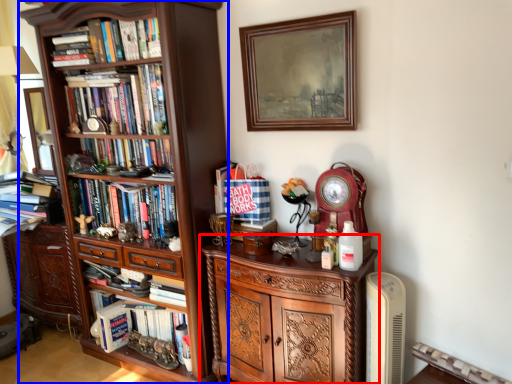
Question: Which of the following is the closest to the observer, cabinetry (highlighted by a red box) or bookcase (highlighted by a blue box)?

Choices:
 (A) cabinetry
 (B) bookcase

Answer: (A)